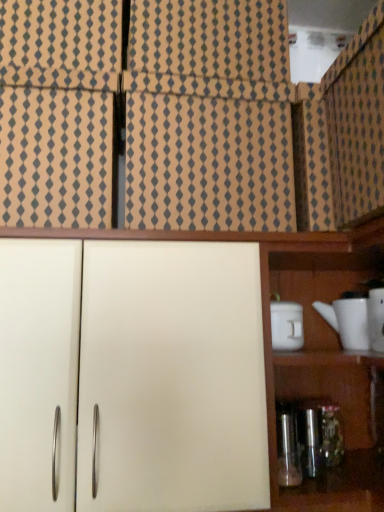
You are a GUI agent. You are given a task and a screenshot of the screen. Output one action in this format:
    pyautogui.click(x=<x>, y=<y>)
    Task: Click on the patterned cardboard at upper left, which is counted as the second cabinetry, starting from the bottom
    
    Given the screenshot: What is the action you would take?
    pyautogui.click(x=55, y=158)

This screenshot has width=384, height=512. What do you see at coordinates (357, 320) in the screenshot?
I see `white glossy teapot at right` at bounding box center [357, 320].

The image size is (384, 512). Identify the location of white matte cabinet at center, marked as the first cabinetry in a bottom-to-top arrangement. (132, 376).

Locate an element on the screen. Image resolution: width=384 pixels, height=512 pixels. patterned cardboard at upper left, which is counted as the second cabinetry, starting from the bottom is located at coordinates (55, 158).

How many degrees apart are the facing directions of metallic glass bottle at lower right and white matte container at right?

metallic glass bottle at lower right and white matte container at right are facing 0.256 degrees away from each other.

Does metallic glass bottle at lower right turn towards white matte container at right?

No, metallic glass bottle at lower right is not facing towards white matte container at right.

Between metallic glass bottle at lower right and white matte container at right, which one has smaller width?

metallic glass bottle at lower right is thinner.

Where is `appliance located above the metallic glass bottle at lower right (from the image's perspective)`? Image resolution: width=384 pixels, height=512 pixels. appliance located above the metallic glass bottle at lower right (from the image's perspective) is located at coordinates (286, 326).

In the image, there is a patterned cardboard at upper left, which is counted as the second cabinetry, starting from the bottom. Where is `tile below it (from the image's perspective)`? tile below it (from the image's perspective) is located at coordinates (208, 164).

From a real-world perspective, is patterned cardboard at upper left, which is counted as the second cabinetry, starting from the bottom, over beige textured tile at upper center?

Incorrect, from a real-world perspective, patterned cardboard at upper left, which is counted as the second cabinetry, starting from the bottom, is lower than beige textured tile at upper center.

Is beige textured tile at upper center located within patterned cardboard at upper left, which is counted as the second cabinetry, starting from the bottom?

No, beige textured tile at upper center is located outside of patterned cardboard at upper left, which is counted as the second cabinetry, starting from the bottom.

Are patterned cardboard at upper left, which is counted as the second cabinetry, starting from the bottom, and beige textured tile at upper center located far from each other?

No, patterned cardboard at upper left, which is counted as the second cabinetry, starting from the bottom, is in close proximity to beige textured tile at upper center.

From a real-world perspective, is white matte cabinet at center, marked as the first cabinetry in a bottom-to-top arrangement, positioned above or below metallic glass bottle at lower right?

white matte cabinet at center, marked as the first cabinetry in a bottom-to-top arrangement, is above metallic glass bottle at lower right.

Is white matte cabinet at center, the second cabinetry from the top, further to the viewer compared to metallic glass bottle at lower right?

No, white matte cabinet at center, the second cabinetry from the top, is closer to the viewer.

Is white matte cabinet at center, marked as the first cabinetry in a bottom-to-top arrangement, inside the boundaries of metallic glass bottle at lower right, or outside?

white matte cabinet at center, marked as the first cabinetry in a bottom-to-top arrangement, is outside metallic glass bottle at lower right.

Locate an element on the screen. The image size is (384, 512). tea set below the beige textured tile at upper center (from the image's perspective) is located at coordinates (357, 320).

Is beige textured tile at upper center at the right side of white glossy teapot at right?

In fact, beige textured tile at upper center is to the left of white glossy teapot at right.

Does beige textured tile at upper center have a lesser width compared to white glossy teapot at right?

No, beige textured tile at upper center is not thinner than white glossy teapot at right.

Is beige textured tile at upper center looking in the opposite direction of white glossy teapot at right?

That's not correct — beige textured tile at upper center is not looking away from white glossy teapot at right.

From the image's perspective, is beige textured tile at upper center over metallic glass bottle at lower right?

Yes, from the image's perspective, beige textured tile at upper center is on top of metallic glass bottle at lower right.

From a real-world perspective, is beige textured tile at upper center on top of metallic glass bottle at lower right?

Indeed, from a real-world perspective, beige textured tile at upper center stands above metallic glass bottle at lower right.

Locate an element on the screen. The width and height of the screenshot is (384, 512). bottle below the beige textured tile at upper center (from a real-world perspective) is located at coordinates click(288, 451).

Which object is positioned more to the left, beige textured tile at upper center or metallic glass bottle at lower right?

beige textured tile at upper center.

Can you confirm if beige textured tile at upper center is thinner than white matte cabinet at center, the second cabinetry from the top?

Yes, beige textured tile at upper center is thinner than white matte cabinet at center, the second cabinetry from the top.

From the image's perspective, is beige textured tile at upper center above or below white matte cabinet at center, the second cabinetry from the top?

Result: Based on their image positions, beige textured tile at upper center is located above white matte cabinet at center, the second cabinetry from the top.

How distant is beige textured tile at upper center from white matte cabinet at center, the second cabinetry from the top?

beige textured tile at upper center and white matte cabinet at center, the second cabinetry from the top, are 24.11 centimeters apart from each other.

Based on the photo, can you confirm if beige textured tile at upper center is positioned to the left of white matte cabinet at center, the second cabinetry from the top?

Correct, you'll find beige textured tile at upper center to the left of white matte cabinet at center, the second cabinetry from the top.

Does point (288, 437) come in front of point (348, 309)?

That is True.

Looking at the image, does metallic glass bottle at lower right seem bigger or smaller compared to white glossy teapot at right?

In the image, metallic glass bottle at lower right appears to be smaller than white glossy teapot at right.

From the image's perspective, is metallic glass bottle at lower right located above or below white glossy teapot at right?

metallic glass bottle at lower right is situated lower than white glossy teapot at right in the image.

Could you tell me if metallic glass bottle at lower right is turned towards white glossy teapot at right?

No, metallic glass bottle at lower right is not oriented towards white glossy teapot at right.

You are a GUI agent. You are given a task and a screenshot of the screen. Output one action in this format:
    pyautogui.click(x=<x>, y=<y>)
    Task: Click on the appliance above the metallic glass bottle at lower right (from the image's perspective)
    The width and height of the screenshot is (384, 512).
    Given the screenshot: What is the action you would take?
    pyautogui.click(x=286, y=326)

You are a GUI agent. You are given a task and a screenshot of the screen. Output one action in this format:
    pyautogui.click(x=<x>, y=<y>)
    Task: Click on the tile that appears above the patterned cardboard at upper left, which is counted as the second cabinetry, starting from the bottom (from a real-world perspective)
    
    Given the screenshot: What is the action you would take?
    pyautogui.click(x=208, y=164)

Looking at the image, which one is located closer to white glossy teapot at right, patterned cardboard at upper left, which is counted as the second cabinetry, starting from the bottom, or white matte cabinet at center, the second cabinetry from the top?

white matte cabinet at center, the second cabinetry from the top.

Considering their positions, is metallic glass bottle at lower right positioned further to white glossy teapot at right than white matte container at right?

metallic glass bottle at lower right is further to white glossy teapot at right.

Based on their spatial positions, is white matte cabinet at center, the second cabinetry from the top, or beige textured tile at upper center closer to metallic glass bottle at lower right?

white matte cabinet at center, the second cabinetry from the top.

Estimate the real-world distances between objects in this image. Which object is further from white matte cabinet at center, the second cabinetry from the top, metallic glass bottle at lower right or white matte container at right?

The object further to white matte cabinet at center, the second cabinetry from the top, is white matte container at right.

Which object lies nearer to the anchor point patterned cardboard at upper left, which is counted as the second cabinetry, starting from the bottom, white matte container at right or beige textured tile at upper center?

beige textured tile at upper center is closer to patterned cardboard at upper left, which is counted as the second cabinetry, starting from the bottom.

Considering their positions, is beige textured tile at upper center positioned further to metallic glass bottle at lower right than white glossy teapot at right?

Among the two, beige textured tile at upper center is located further to metallic glass bottle at lower right.

Considering their positions, is white matte cabinet at center, marked as the first cabinetry in a bottom-to-top arrangement, positioned closer to white matte container at right than metallic glass bottle at lower right?

The object closer to white matte container at right is metallic glass bottle at lower right.

Considering their positions, is white matte cabinet at center, the second cabinetry from the top, positioned closer to white glossy teapot at right than beige textured tile at upper center?

beige textured tile at upper center.

Where is `tile between patterned cardboard at upper left, acting as the 1th cabinetry starting from the top, and white matte container at right`? The height and width of the screenshot is (512, 384). tile between patterned cardboard at upper left, acting as the 1th cabinetry starting from the top, and white matte container at right is located at coordinates (208, 164).

At what (x,y) coordinates should I click in order to perform the action: click on appliance that lies between beige textured tile at upper center and white matte cabinet at center, the second cabinetry from the top, from top to bottom. Please return your answer as a coordinate pair (x, y). The image size is (384, 512). Looking at the image, I should click on (286, 326).

The image size is (384, 512). I want to click on cabinetry that lies between beige textured tile at upper center and metallic glass bottle at lower right from top to bottom, so click(132, 376).

At what (x,y) coordinates should I click in order to perform the action: click on bottle between patterned cardboard at upper left, which is counted as the second cabinetry, starting from the bottom, and white glossy teapot at right, in the horizontal direction. Please return your answer as a coordinate pair (x, y). Looking at the image, I should click on (288, 451).